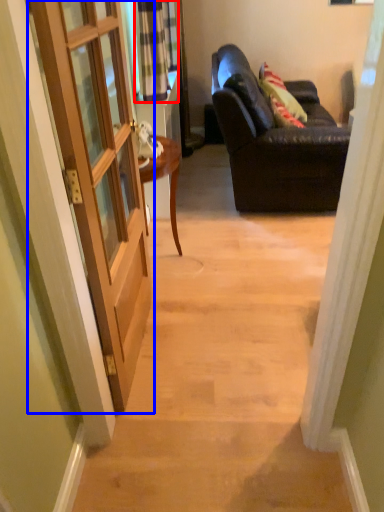
Question: Which point is closer to the camera, curtain (highlighted by a red box) or door (highlighted by a blue box)?

Choices:
 (A) curtain
 (B) door

Answer: (B)